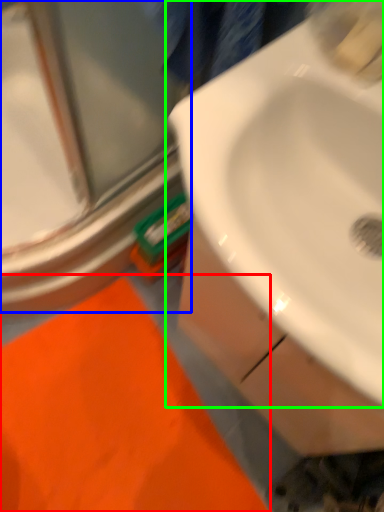
Question: Which is nearer to the bath mat (highlighted by a red box)? glass door (highlighted by a blue box) or sink (highlighted by a green box).

Choices:
 (A) glass door
 (B) sink

Answer: (A)